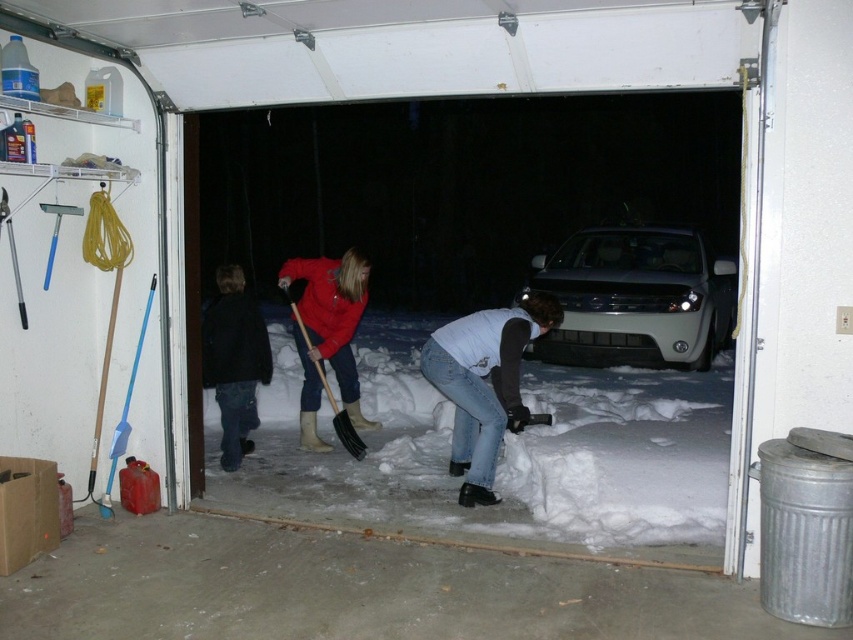
Measure the distance from white matte jeans at lower center to black woolen jacket at center.

white matte jeans at lower center and black woolen jacket at center are 5.59 feet apart.

Can you confirm if white matte jeans at lower center is positioned to the left of black woolen jacket at center?

Incorrect, white matte jeans at lower center is not on the left side of black woolen jacket at center.

This screenshot has height=640, width=853. In order to click on white matte jeans at lower center in this screenshot , I will do `click(485, 384)`.

Between point (659, 285) and point (126, 408), which one is positioned in front?

Point (126, 408) is in front.

Which of these two, satin silver car at center or blue plastic shovel at left, stands shorter?

With less height is blue plastic shovel at left.

Image resolution: width=853 pixels, height=640 pixels. Find the location of `satin silver car at center`. satin silver car at center is located at coordinates (634, 298).

Can you confirm if satin silver car at center is thinner than black woolen jacket at center?

No.

Is satin silver car at center to the left of black woolen jacket at center from the viewer's perspective?

Incorrect, satin silver car at center is not on the left side of black woolen jacket at center.

Does point (669, 248) come farther from viewer compared to point (230, 465)?

That is True.

This screenshot has width=853, height=640. I want to click on satin silver car at center, so click(x=634, y=298).